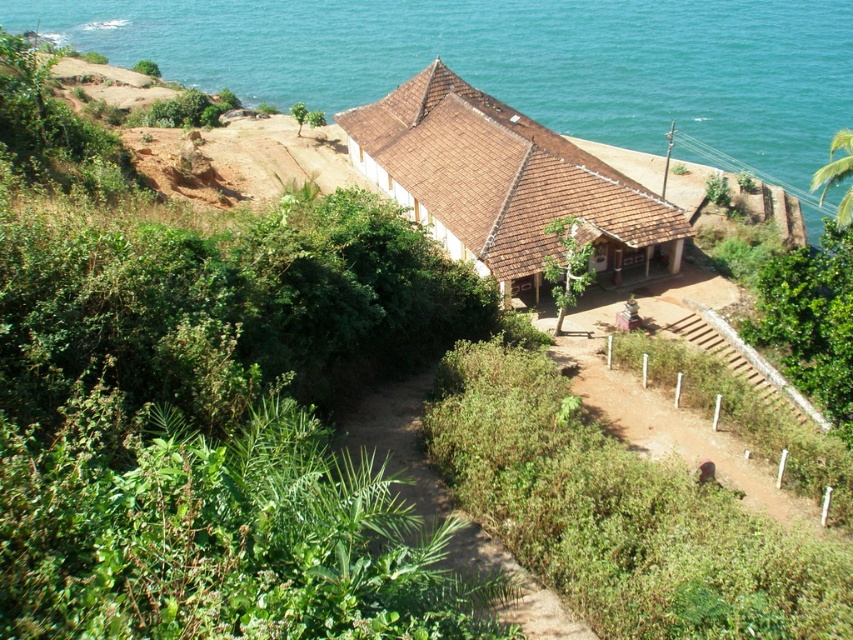
You are standing at the point marked by point (505, 184) in the image. What structure are you directly facing?

The point (505, 184) indicates brown tiled hut at center, so you are directly facing the brown tiled hut at center.

You are a visitor approaching the building and see the blue water at upper center and the dried dirt path at center. Which object is closer to you as you walk towards the building?

The dried dirt path at center is behind blue water at upper center, so the blue water at upper center is closer to you as you walk towards the building.